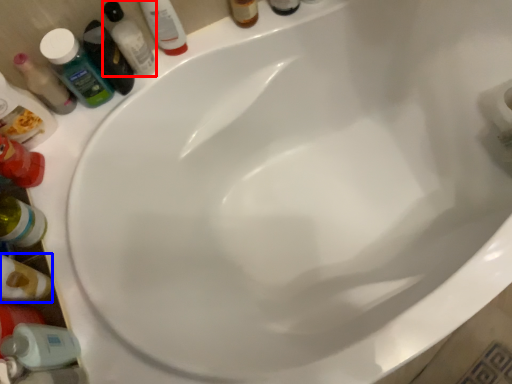
Question: Which of the following is the closest to the observer, mouthwash (highlighted by a red box) or bottle (highlighted by a blue box)?

Choices:
 (A) mouthwash
 (B) bottle

Answer: (B)